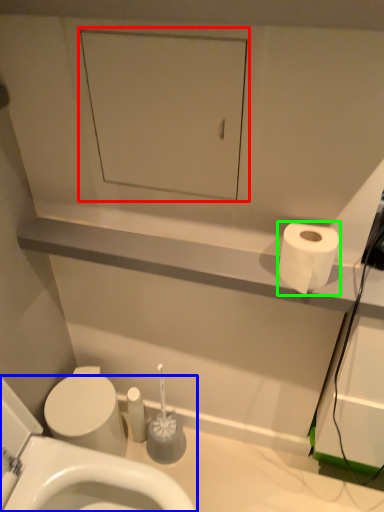
Question: Which object is positioned closest to medicine cabinet (highlighted by a red box)? Select from toilet (highlighted by a blue box) and toilet paper (highlighted by a green box).

Choices:
 (A) toilet
 (B) toilet paper

Answer: (B)